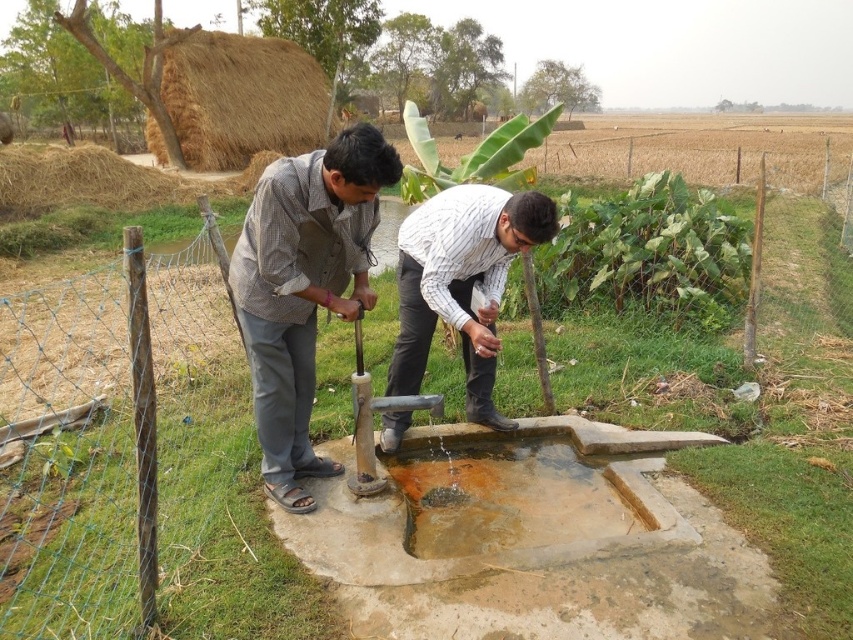
Question: Is matte gray shirt at center above white striped shirt at center?

Choices:
 (A) no
 (B) yes

Answer: (A)

Question: Considering the relative positions of matte gray shirt at center and white striped shirt at center in the image provided, where is matte gray shirt at center located with respect to white striped shirt at center?

Choices:
 (A) left
 (B) right

Answer: (A)

Question: Does matte gray shirt at center have a smaller size compared to brown concrete puddle at center?

Choices:
 (A) no
 (B) yes

Answer: (A)

Question: Which point is farther to the camera?

Choices:
 (A) brown concrete puddle at center
 (B) white striped shirt at center
 (C) matte gray shirt at center

Answer: (B)

Question: Which point is closer to the camera?

Choices:
 (A) (534, 236)
 (B) (619, 529)
 (C) (296, 196)

Answer: (C)

Question: Which point is farther to the camera?

Choices:
 (A) (351, 301)
 (B) (543, 504)

Answer: (B)